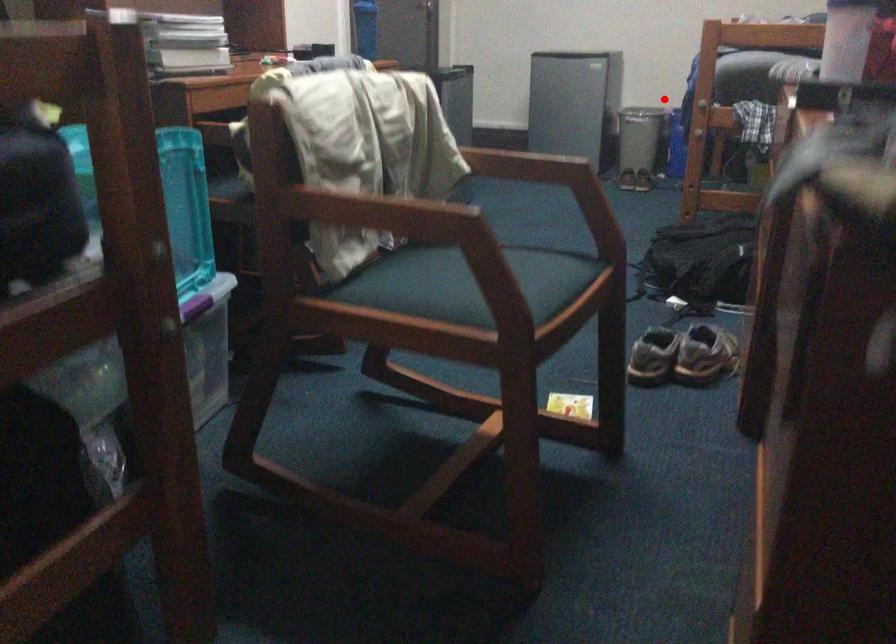
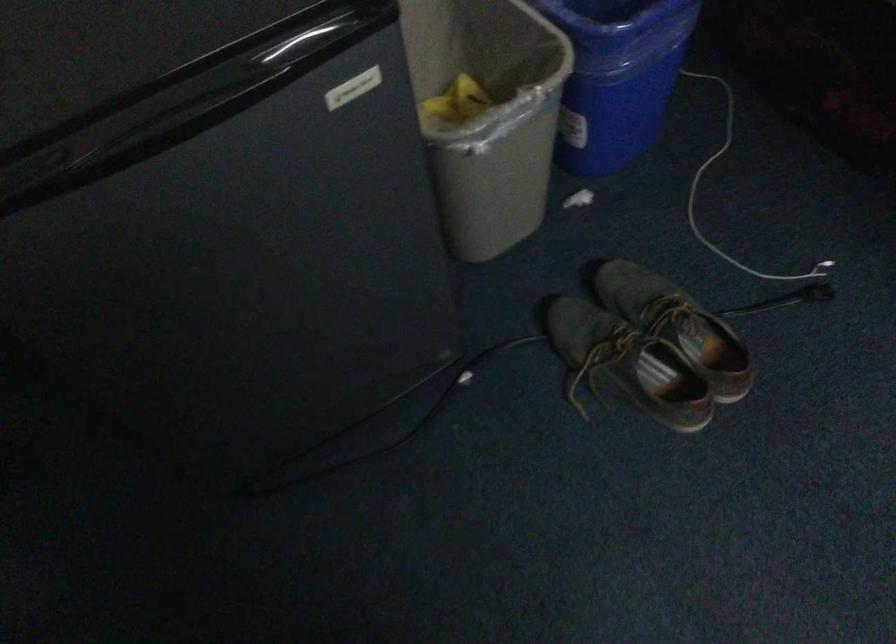
Question: A red point is marked in image1. In image2, is the corresponding 3D point closer to the camera or farther? Reply with the corresponding letter.

Choices:
 (A) The corresponding 3D point is closer.
 (B) The corresponding 3D point is farther.

Answer: (A)